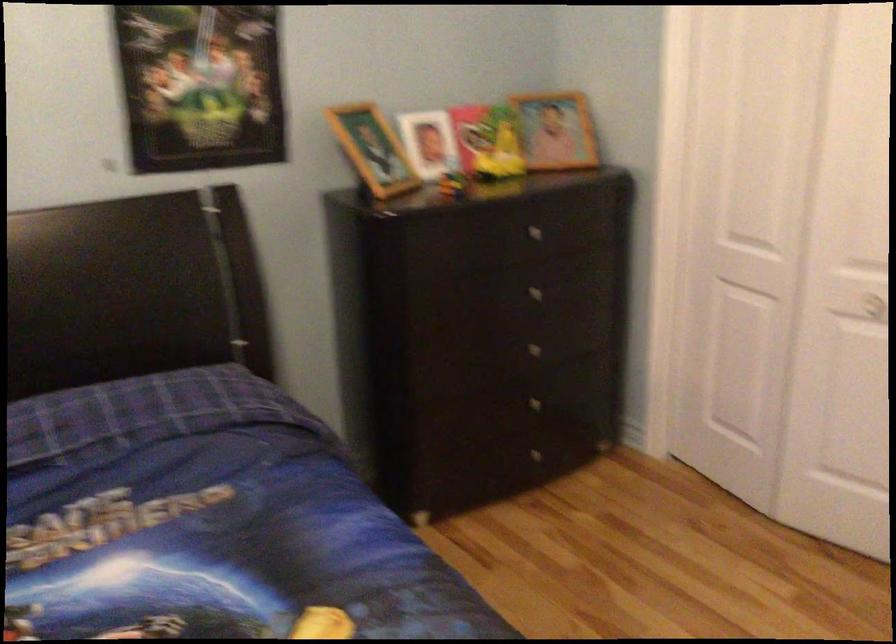
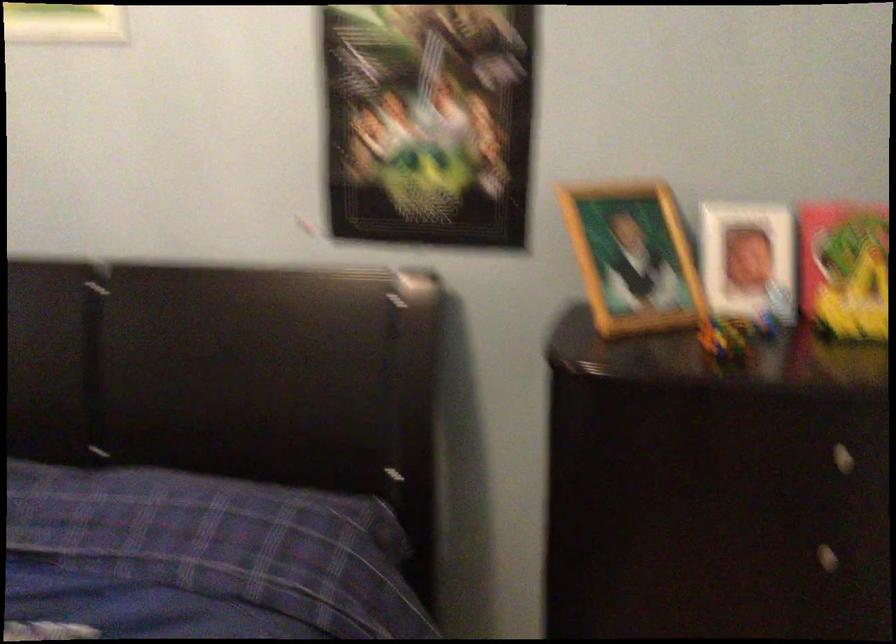
Where in the second image is the point corresponding to point (528, 297) from the first image?

(807, 554)